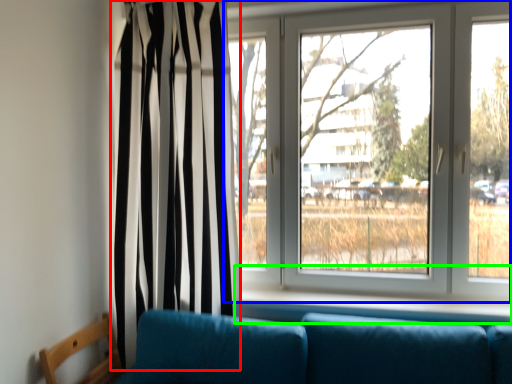
Question: Which object is the farthest from curtain (highlighted by a red box)? Choose among these: window (highlighted by a blue box) or window sill (highlighted by a green box).

Choices:
 (A) window
 (B) window sill

Answer: (B)